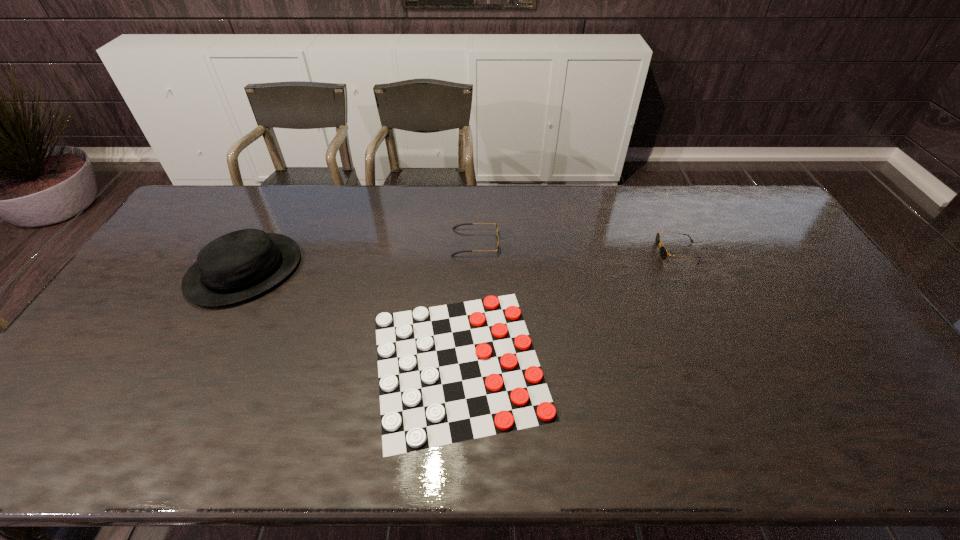
Locate an element on the screen. vacant space that's between the right sunglasses and the tallest object is located at coordinates (461, 261).

Where is `free space between the left sunglasses and the right sunglasses`? Image resolution: width=960 pixels, height=540 pixels. free space between the left sunglasses and the right sunglasses is located at coordinates (576, 247).

At what (x,y) coordinates should I click in order to perform the action: click on free space between the shortest object and the tallest object. Please return your answer as a coordinate pair (x, y). The height and width of the screenshot is (540, 960). Looking at the image, I should click on (351, 317).

You are a GUI agent. You are given a task and a screenshot of the screen. Output one action in this format:
    pyautogui.click(x=<x>, y=<y>)
    Task: Click on the unoccupied area between the right sunglasses and the fedora
    
    Given the screenshot: What is the action you would take?
    pyautogui.click(x=461, y=261)

At what (x,y) coordinates should I click in order to perform the action: click on vacant area that lies between the checkerboard and the right sunglasses. Please return your answer as a coordinate pair (x, y). The width and height of the screenshot is (960, 540). Looking at the image, I should click on (567, 308).

Where is `free spot between the checkerboard and the fedora`? This screenshot has height=540, width=960. free spot between the checkerboard and the fedora is located at coordinates (351, 317).

Choose which object is the second nearest neighbor to the rightmost object. Please provide its 2D coordinates. Your answer should be formatted as a tuple, i.e. [(x, y)], where the tuple contains the x and y coordinates of a point satisfying the conditions above.

[(496, 224)]

Locate an element on the screen. Image resolution: width=960 pixels, height=540 pixels. the third closest object to the shortest object is located at coordinates click(663, 252).

Where is `blank space that satisfies the following two spatial constraints: 1. on the front-facing side of the left sunglasses; 2. on the front side of the tallest object`? The height and width of the screenshot is (540, 960). blank space that satisfies the following two spatial constraints: 1. on the front-facing side of the left sunglasses; 2. on the front side of the tallest object is located at coordinates [x=474, y=271].

Find the location of a particular element. free region that satisfies the following two spatial constraints: 1. on the front-facing side of the left sunglasses; 2. on the front side of the checkerboard is located at coordinates (473, 363).